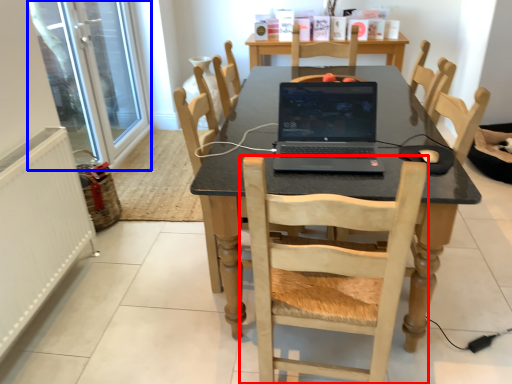
Question: Which object is further to the camera taking this photo, chair (highlighted by a red box) or screen door (highlighted by a blue box)?

Choices:
 (A) chair
 (B) screen door

Answer: (B)